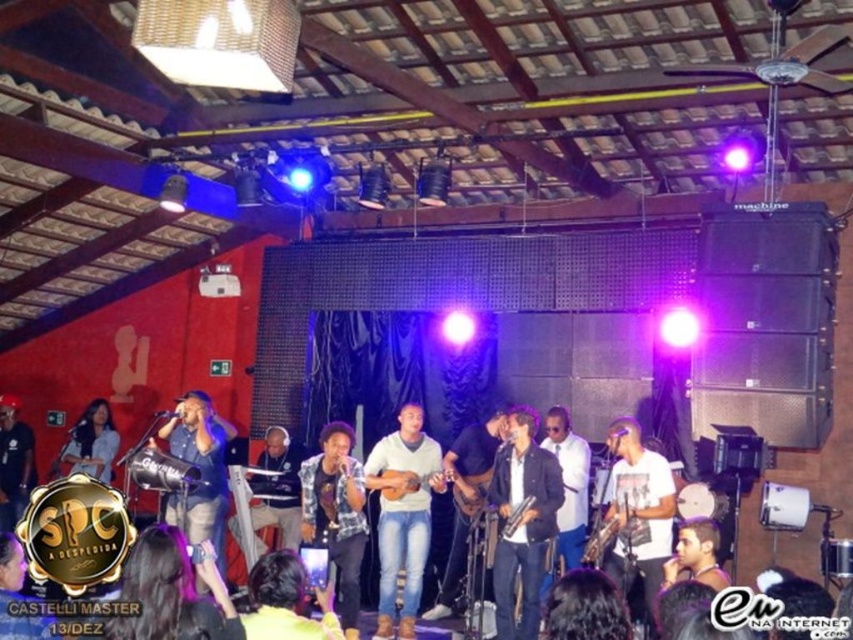
Question: From the image, what is the correct spatial relationship of plaid shirt at center in relation to matte black guitar at left?

Choices:
 (A) right
 (B) left

Answer: (A)

Question: Does wooden acoustic guitar at center have a smaller size compared to wooden saxophone at center?

Choices:
 (A) no
 (B) yes

Answer: (B)

Question: Estimate the real-world distances between objects in this image. Which object is closer to the wooden saxophone at center?

Choices:
 (A) plaid shirt at center
 (B) wooden acoustic guitar at center
 (C) matte black guitar at left
 (D) metallic silver drum at center

Answer: (B)

Question: Which object is the closest to the matte black guitar at left?

Choices:
 (A) plaid shirt at center
 (B) metallic silver drum at center
 (C) wooden acoustic guitar at center
 (D) white matte sweater at center

Answer: (B)

Question: Is plaid shirt at center further to camera compared to metallic silver drum at center?

Choices:
 (A) no
 (B) yes

Answer: (A)

Question: Considering the real-world distances, which object is farthest from the wooden saxophone at center?

Choices:
 (A) matte black guitar at left
 (B) white matte sweater at center
 (C) wooden acoustic guitar at center
 (D) plaid shirt at center

Answer: (A)